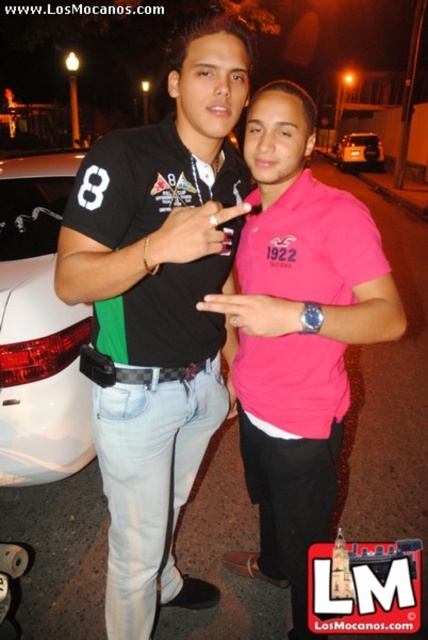
Who is positioned more to the left, white glossy car at left or metallic silver car at center?

Positioned to the left is white glossy car at left.

Measure the distance between point [23,282] and camera.

Point [23,282] is 2.31 meters away from camera.

Where is `white glossy car at left`? The height and width of the screenshot is (640, 428). white glossy car at left is located at coordinates (38, 330).

Where is `white glossy car at left`? white glossy car at left is located at coordinates point(38,330).